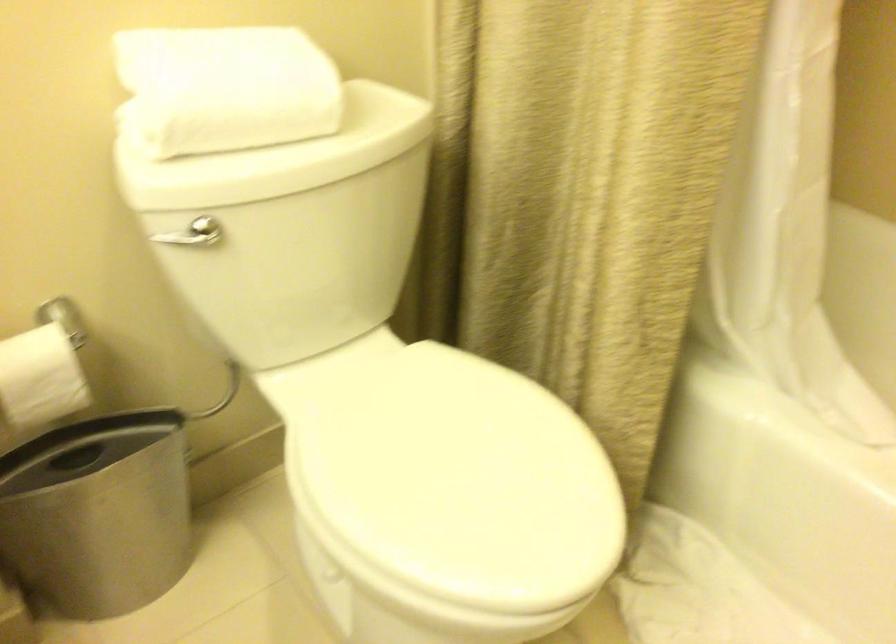
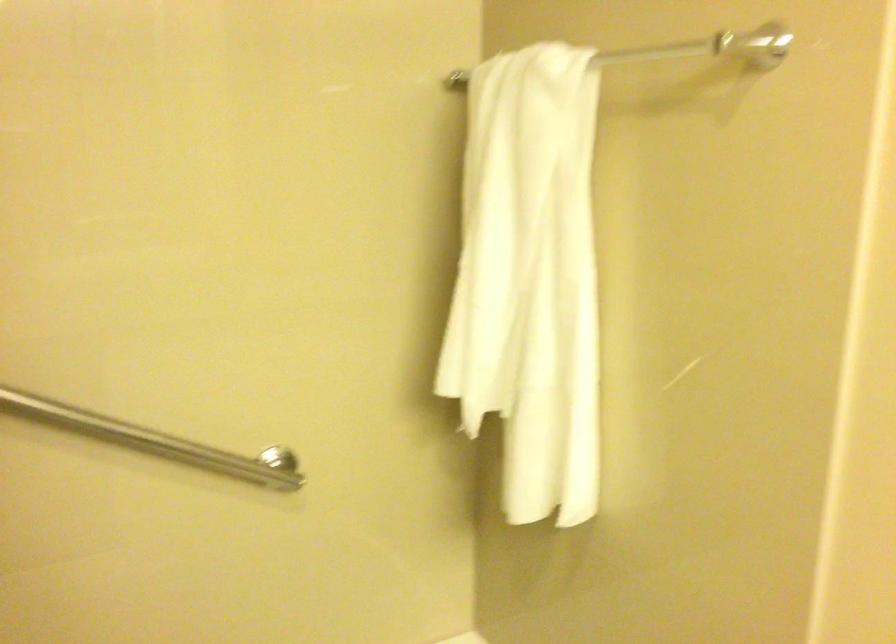
Question: Based on the continuous images, in which direction is the camera rotating? Reply with the corresponding letter.

Choices:
 (A) Left
 (B) Right
 (C) Up
 (D) Down

Answer: (B)